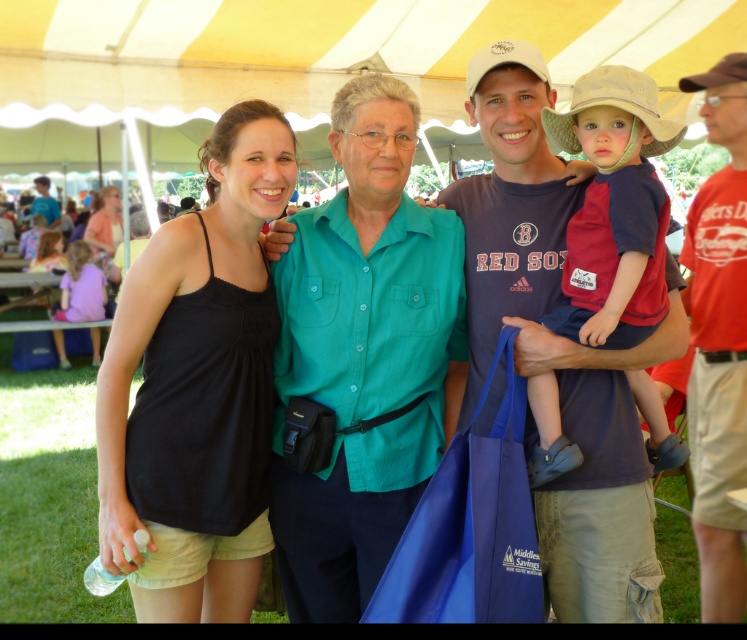
You are standing at the center of the image and want to place a new object at the same location as the beige fabric cowboy hat at upper right. What are the coordinates you should use?

The coordinates for the beige fabric cowboy hat at upper right are point (613, 106).

You are standing at the point marked by coordinates point (595, 99) and want to take a photo of the older woman with the camera attached to her waist. Can you reach her camera from your current position without moving?

The distance between point (595, 99) and the camera is 1.85 meters. Since you are at point (595, 99), you cannot reach the camera attached to the older woman without moving closer.

Based on the coordinates provided, which object is located at point [557,346]?

The point at [557,346] marks the location of the matte blue shirt at center.